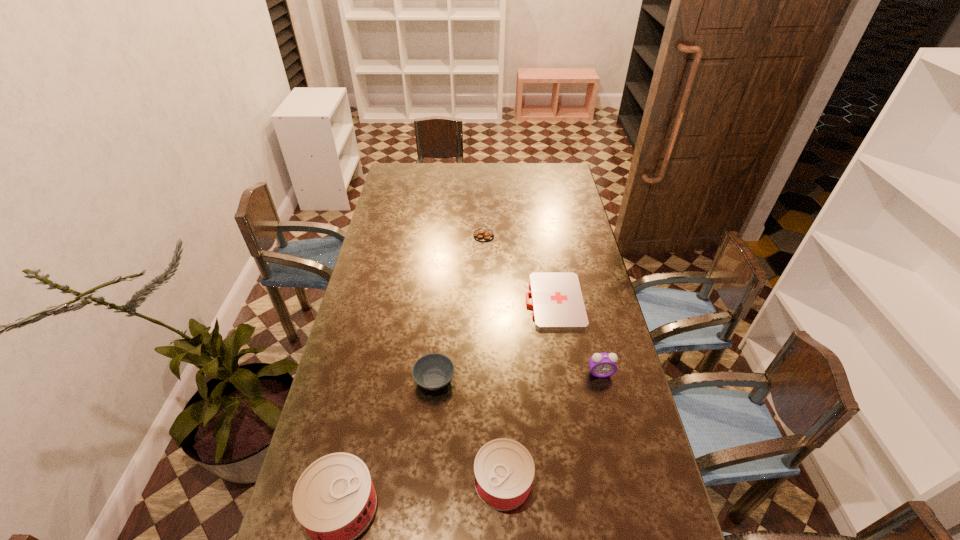
This screenshot has height=540, width=960. Find the location of `free space between the farthest object and the first-aid kit`. free space between the farthest object and the first-aid kit is located at coordinates (518, 268).

Locate an element on the screen. This screenshot has height=540, width=960. free space between the shortest object and the shorter can is located at coordinates (529, 391).

Where is `free space between the alarm clock and the second farthest object`? The height and width of the screenshot is (540, 960). free space between the alarm clock and the second farthest object is located at coordinates (577, 337).

Choose which object is the third nearest neighbor to the leftmost object. Please provide its 2D coordinates. Your answer should be formatted as a tuple, i.e. [(x, y)], where the tuple contains the x and y coordinates of a point satisfying the conditions above.

[(557, 301)]

Where is `object that is the fourth closest to the farthest object`? object that is the fourth closest to the farthest object is located at coordinates (504, 469).

Identify the location of vacant region that satisfies the following two spatial constraints: 1. on the front side of the farthest object; 2. on the left side of the shorter can. (487, 481).

The height and width of the screenshot is (540, 960). What are the coordinates of `blank space that satisfies the following two spatial constraints: 1. on handle side the first-aid kit; 2. on the front side of the fifth object from right to left` in the screenshot? It's located at (567, 379).